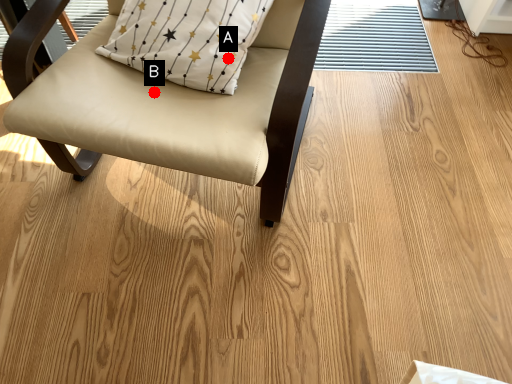
Question: Two points are circled on the image, labeled by A and B beside each circle. Which of the following is the closest to the observer?

Choices:
 (A) A is closer
 (B) B is closer

Answer: (A)